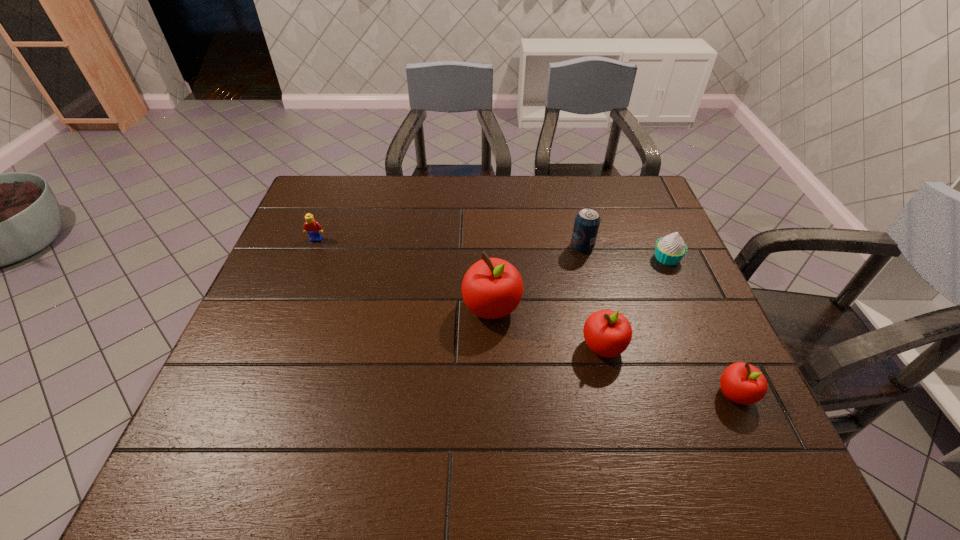
What are the coordinates of `the tallest apple` in the screenshot? It's located at pyautogui.click(x=492, y=288).

I want to click on the tallest object, so click(492, 288).

Where is `the second shortest apple`? The height and width of the screenshot is (540, 960). the second shortest apple is located at coordinates (608, 333).

Find the location of a particular element. This screenshot has width=960, height=540. the shortest apple is located at coordinates (742, 383).

Find the location of `the nearest object`. the nearest object is located at coordinates (742, 383).

Identify the location of cupcake. The width and height of the screenshot is (960, 540). 669,250.

The height and width of the screenshot is (540, 960). I want to click on pop soda, so click(x=587, y=221).

The height and width of the screenshot is (540, 960). I want to click on the leftmost object, so click(x=313, y=228).

Locate an element on the screen. free location located 0.150m on the back of the tallest apple is located at coordinates (491, 248).

Where is `vacant space located on the front of the second apple from right to left`? The height and width of the screenshot is (540, 960). vacant space located on the front of the second apple from right to left is located at coordinates (620, 416).